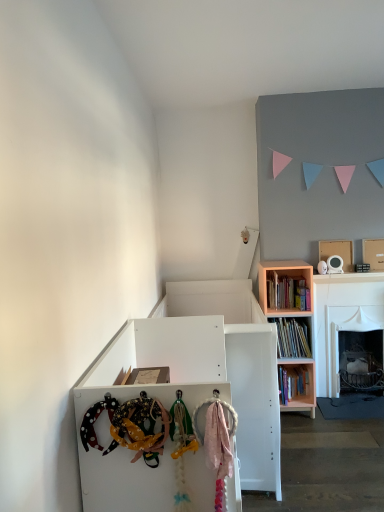
Measure the distance between pink wood bookcase at right and camera.

pink wood bookcase at right and camera are 3.13 meters apart from each other.

Measure the distance between white cardboard box at upper right and camera.

white cardboard box at upper right and camera are 3.38 meters apart.

Describe the element at coordinates (140, 428) in the screenshot. I see `polka dot fabric headband at lower left` at that location.

Find the location of a particular element. The image size is (384, 512). polka dot fabric headband at lower left is located at coordinates 140,428.

The height and width of the screenshot is (512, 384). Find the location of `white matte cabinet at center`. white matte cabinet at center is located at coordinates (151, 397).

Is there a large distance between pink wood bookcase at right and pink matte bookshelf at upper right?

No, pink wood bookcase at right is not far away from pink matte bookshelf at upper right.

Consider the image. Is pink wood bookcase at right to the left of pink matte bookshelf at upper right from the viewer's perspective?

No, pink wood bookcase at right is not to the left of pink matte bookshelf at upper right.

The height and width of the screenshot is (512, 384). Find the location of `bookcase in front of the pink matte bookshelf at upper right`. bookcase in front of the pink matte bookshelf at upper right is located at coordinates tap(290, 328).

From a real-world perspective, relative to pink matte bookshelf at upper right, is pink wood bookcase at right vertically above or below?

In terms of real-world spatial position, pink wood bookcase at right is below pink matte bookshelf at upper right.

Is pink wood bookcase at right smaller than white cardboard box at upper right?

No.

You are a GUI agent. You are given a task and a screenshot of the screen. Output one action in this format:
    pyautogui.click(x=<x>, y=<y>)
    Task: Click on the bookcase below the white cardboard box at upper right (from the image's perspective)
    
    Given the screenshot: What is the action you would take?
    pyautogui.click(x=290, y=328)

In terms of height, does pink wood bookcase at right look taller or shorter compared to white cardboard box at upper right?

Considering their sizes, pink wood bookcase at right has more height than white cardboard box at upper right.

Does pink wood bookcase at right contain white cardboard box at upper right?

Definitely not — white cardboard box at upper right is not inside pink wood bookcase at right.

Does white cardboard box at upper right lie in front of polka dot fabric headband at lower left?

No, it is not.

Could you tell me if white cardboard box at upper right is turned towards polka dot fabric headband at lower left?

No, white cardboard box at upper right is not aimed at polka dot fabric headband at lower left.

Consider the image. Considering the sizes of objects white cardboard box at upper right and polka dot fabric headband at lower left in the image provided, who is shorter, white cardboard box at upper right or polka dot fabric headband at lower left?

polka dot fabric headband at lower left is shorter.

Is point (157, 414) closer to camera compared to point (186, 356)?

Yes.

Is the depth of polka dot fabric headband at lower left less than that of white matte cabinet at center?

Yes, it is.

Considering the relative positions of polka dot fabric headband at lower left and white matte cabinet at center in the image provided, is polka dot fabric headband at lower left to the right of white matte cabinet at center from the viewer's perspective?

No, polka dot fabric headband at lower left is not to the right of white matte cabinet at center.

From the image's perspective, is polka dot fabric headband at lower left located above or below white matte cabinet at center?

From the image's perspective, polka dot fabric headband at lower left appears above white matte cabinet at center.

Does white cardboard box at upper right turn towards white matte cabinet at center?

No, white cardboard box at upper right is not facing towards white matte cabinet at center.

Does point (346, 247) come closer to viewer compared to point (130, 339)?

No, it is not.

The image size is (384, 512). I want to click on cabinetry below the white cardboard box at upper right (from a real-world perspective), so click(151, 397).

Considering the positions of objects white cardboard box at upper right and white matte cabinet at center in the image provided, who is more to the right, white cardboard box at upper right or white matte cabinet at center?

From the viewer's perspective, white cardboard box at upper right appears more on the right side.

Which object is closer to the camera, polka dot fabric headband at lower left or white cardboard box at upper right?

polka dot fabric headband at lower left is more forward.

Looking at this image, can you confirm if polka dot fabric headband at lower left is taller than white cardboard box at upper right?

No, polka dot fabric headband at lower left is not taller than white cardboard box at upper right.

Is polka dot fabric headband at lower left outside of white cardboard box at upper right?

polka dot fabric headband at lower left is positioned outside white cardboard box at upper right.

Could you tell me if polka dot fabric headband at lower left is facing white cardboard box at upper right?

No, polka dot fabric headband at lower left is not oriented towards white cardboard box at upper right.

You are a GUI agent. You are given a task and a screenshot of the screen. Output one action in this format:
    pyautogui.click(x=<x>, y=<y>)
    Task: Click on the cabinetry that appears in front of the pink matte bookshelf at upper right
    This screenshot has width=384, height=512.
    Given the screenshot: What is the action you would take?
    pyautogui.click(x=151, y=397)

Would you say white matte cabinet at center is inside or outside pink matte bookshelf at upper right?

white matte cabinet at center lies outside pink matte bookshelf at upper right.

Consider the image. Is white matte cabinet at center positioned with its back to pink matte bookshelf at upper right?

No, white matte cabinet at center's orientation is not away from pink matte bookshelf at upper right.

From a real-world perspective, which is physically above, white matte cabinet at center or pink matte bookshelf at upper right?

In real-world perspective, pink matte bookshelf at upper right is above.

What are the coordinates of `bookcase in front of the pink matte bookshelf at upper right` in the screenshot? It's located at pos(290,328).

Identify the location of bookcase below the white cardboard box at upper right (from a real-world perspective). The height and width of the screenshot is (512, 384). (290, 328).

Estimate the real-world distances between objects in this image. Which object is closer to white matte cabinet at center, polka dot fabric headband at lower left or white cardboard box at upper right?

The object closer to white matte cabinet at center is polka dot fabric headband at lower left.

Estimate the real-world distances between objects in this image. Which object is further from white cardboard box at upper right, pink matte bookshelf at upper right or white matte cabinet at center?

Based on the image, white matte cabinet at center appears to be further to white cardboard box at upper right.

From the image, which object appears to be farther from polka dot fabric headband at lower left, white matte cabinet at center or white cardboard box at upper right?

white cardboard box at upper right is further to polka dot fabric headband at lower left.

Estimate the real-world distances between objects in this image. Which object is further from white matte cabinet at center, pink wood bookcase at right or white cardboard box at upper right?

white cardboard box at upper right.

Considering their positions, is white matte cabinet at center positioned closer to white cardboard box at upper right than pink wood bookcase at right?

pink wood bookcase at right is positioned closer to the anchor white cardboard box at upper right.

Looking at the image, which one is located closer to white cardboard box at upper right, polka dot fabric headband at lower left or pink wood bookcase at right?

The object closer to white cardboard box at upper right is pink wood bookcase at right.

Looking at the image, which one is located closer to pink matte bookshelf at upper right, white matte cabinet at center or white cardboard box at upper right?

white cardboard box at upper right lies closer to pink matte bookshelf at upper right than the other object.

Considering their positions, is white matte cabinet at center positioned closer to pink matte bookshelf at upper right than pink wood bookcase at right?

pink wood bookcase at right is positioned closer to the anchor pink matte bookshelf at upper right.

This screenshot has width=384, height=512. In order to click on cabinetry positioned between polka dot fabric headband at lower left and white cardboard box at upper right from near to far in this screenshot , I will do `click(151, 397)`.

You are a GUI agent. You are given a task and a screenshot of the screen. Output one action in this format:
    pyautogui.click(x=<x>, y=<y>)
    Task: Click on the book between polka dot fabric headband at lower left and white cardboard box at upper right in the front-back direction
    
    Given the screenshot: What is the action you would take?
    pyautogui.click(x=287, y=292)

Identify the location of bookcase positioned between white matte cabinet at center and pink matte bookshelf at upper right from near to far. (290, 328).

In order to click on book between white matte cabinet at center and white cardboard box at upper right from front to back in this screenshot , I will do `click(287, 292)`.